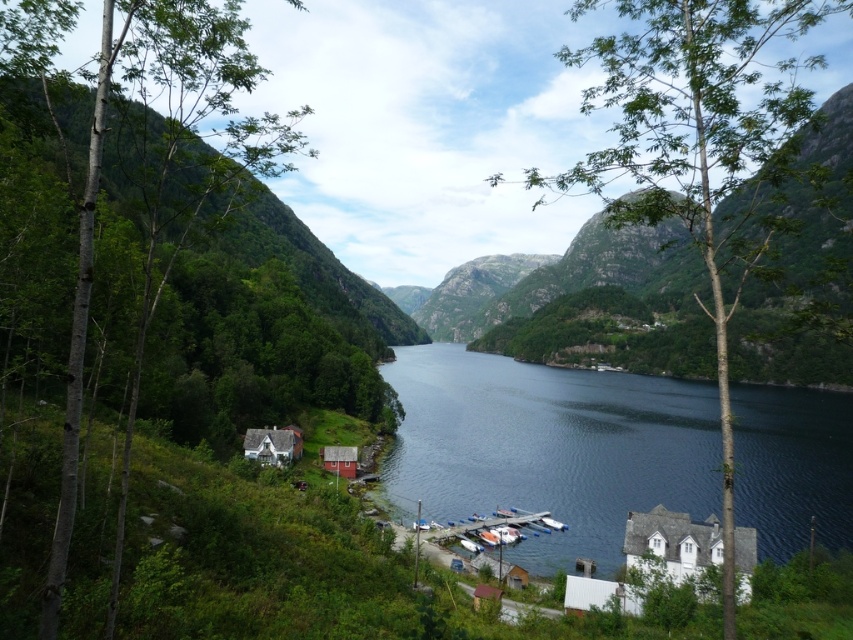
Can you confirm if green leafy tree at left is shorter than white wooden house at lower right?

Answer: No.

Between point (123, 86) and point (734, 545), which one is positioned in front?

Point (123, 86)

At what (x,y) coordinates should I click in order to perform the action: click on green leafy tree at left. Please return your answer as a coordinate pair (x, y). Looking at the image, I should click on (161, 186).

Can you confirm if white wooden house at lower right is wider than wooden cabin at lower center?

Correct, the width of white wooden house at lower right exceeds that of wooden cabin at lower center.

Is white wooden house at lower right in front of wooden cabin at lower center?

Yes, white wooden house at lower right is closer to the viewer.

Where is `white wooden house at lower right`? The width and height of the screenshot is (853, 640). white wooden house at lower right is located at coordinates (671, 544).

Locate an element on the screen. This screenshot has height=640, width=853. white wooden house at lower right is located at coordinates (671, 544).

Who is positioned more to the right, white wooden house at lower left or wooden cabin at lower center?

From the viewer's perspective, wooden cabin at lower center appears more on the right side.

Between white wooden house at lower left and wooden cabin at lower center, which one has more height?

With more height is white wooden house at lower left.

Image resolution: width=853 pixels, height=640 pixels. Describe the element at coordinates (273, 444) in the screenshot. I see `white wooden house at lower left` at that location.

Image resolution: width=853 pixels, height=640 pixels. I want to click on white wooden house at lower left, so click(273, 444).